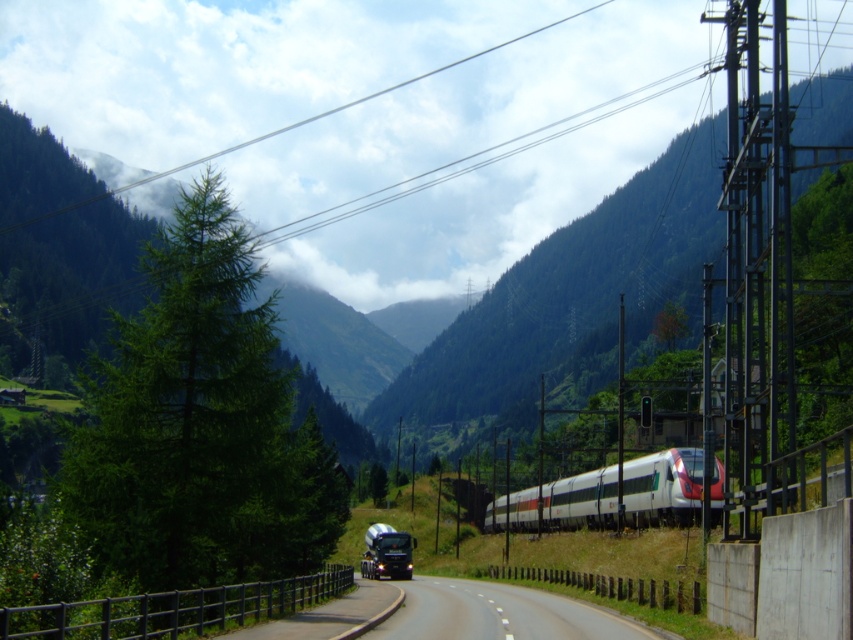
Is asphalt road at center positioned in front of white glossy passenger train at center-right?

Yes.

Consider the image. Between asphalt road at center and white glossy passenger train at center-right, which one appears on the right side from the viewer's perspective?

white glossy passenger train at center-right is more to the right.

Which is behind, point (401, 612) or point (691, 456)?

Point (691, 456)

The image size is (853, 640). What are the coordinates of `asphalt road at center` in the screenshot? It's located at (500, 614).